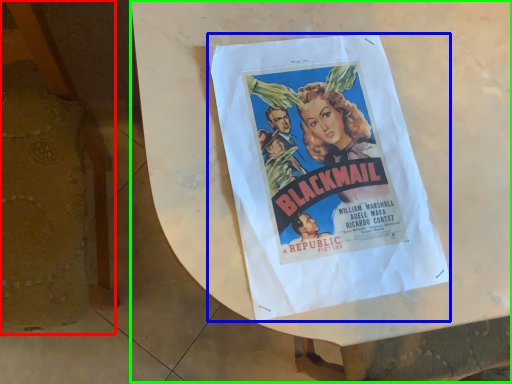
Question: Which object is the farthest from furniture (highlighted by a red box)? Choose among these: poster (highlighted by a blue box) or round table (highlighted by a green box).

Choices:
 (A) poster
 (B) round table

Answer: (A)